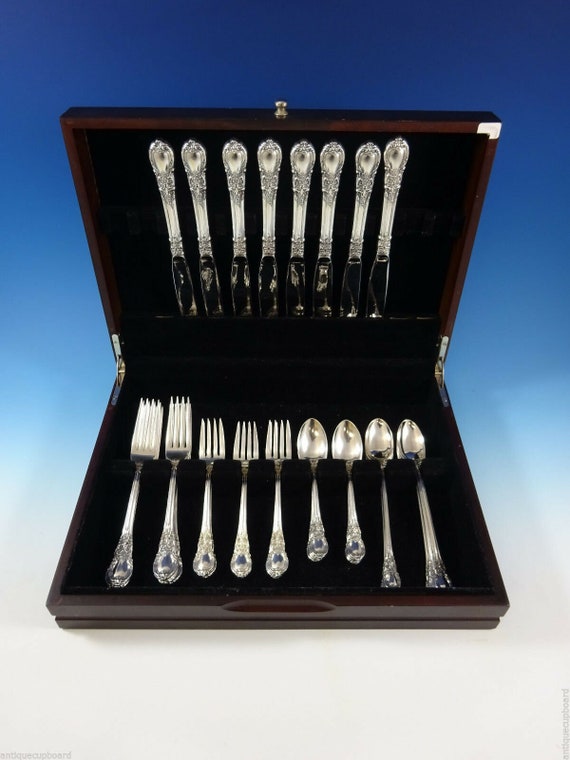
Find the location of a particular element. knives is located at coordinates (397, 147), (368, 157), (333, 154), (302, 157), (271, 157), (233, 157), (197, 156), (161, 157).